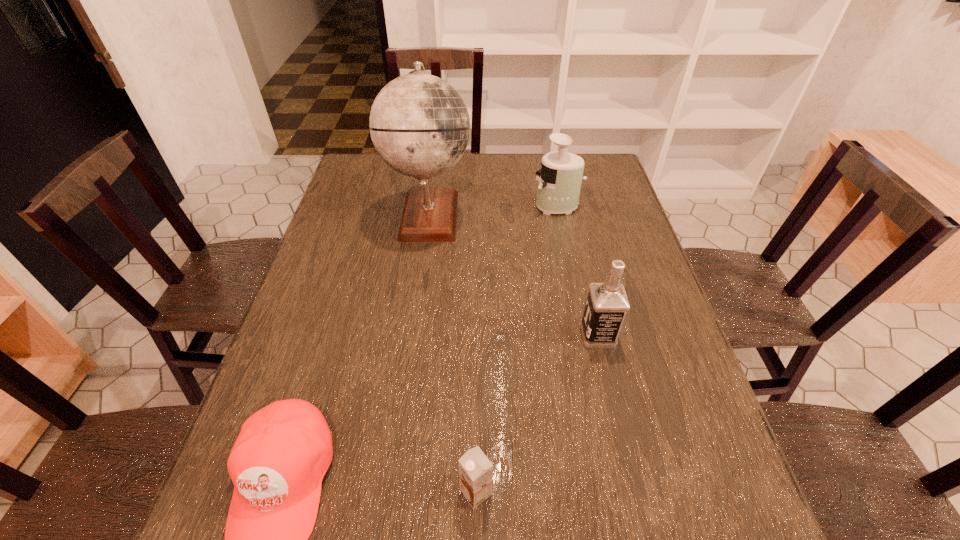
Where is `object at the far edge`? object at the far edge is located at coordinates (419, 124).

Find the location of a particular element. This screenshot has width=960, height=540. juicer located at the right edge is located at coordinates (560, 180).

In order to click on vodka at the right edge in this screenshot , I will do `click(607, 303)`.

Identify the location of free location at the far edge of the desktop. This screenshot has height=540, width=960. (x=503, y=176).

Where is `vacant area at the left edge`? This screenshot has height=540, width=960. vacant area at the left edge is located at coordinates (354, 290).

I want to click on vacant space at the right edge, so click(x=634, y=247).

Image resolution: width=960 pixels, height=540 pixels. I want to click on vacant area at the far right corner of the desktop, so click(590, 156).

Identify the location of blank region between the chocolate milk and the vodka. (537, 414).

You are a GUI agent. You are given a task and a screenshot of the screen. Output one action in this format:
    pyautogui.click(x=<x>, y=<y>)
    Task: Click on the free space between the third nearest object and the tallest object
    This screenshot has width=960, height=540.
    Given the screenshot: What is the action you would take?
    pyautogui.click(x=514, y=275)

I want to click on free space between the tallest object and the chocolate milk, so pyautogui.click(x=453, y=353).